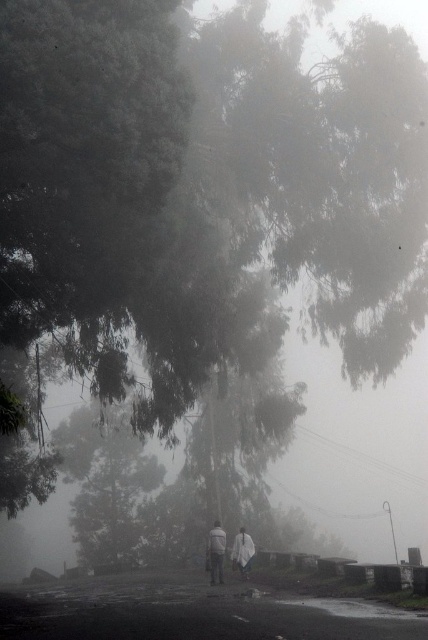
This screenshot has width=428, height=640. I want to click on white matte coat at center, so click(216, 552).

Which is behind, point (244, 550) or point (241, 556)?

The point (244, 550) is behind.

Image resolution: width=428 pixels, height=640 pixels. What do you see at coordinates (216, 552) in the screenshot?
I see `white matte coat at center` at bounding box center [216, 552].

The image size is (428, 640). I want to click on white matte coat at center, so click(x=216, y=552).

Does white matte jacket at lower center appear under white matte jacket at center?

Incorrect, white matte jacket at lower center is not positioned below white matte jacket at center.

Can you confirm if white matte jacket at lower center is shorter than white matte jacket at center?

Yes.

The image size is (428, 640). What do you see at coordinates (216, 552) in the screenshot? I see `white matte jacket at lower center` at bounding box center [216, 552].

The height and width of the screenshot is (640, 428). I want to click on white matte jacket at lower center, so click(216, 552).

Looking at this image, is white matte coat at center closer to the viewer compared to white matte jacket at lower center?

That is True.

Is point (213, 582) positioned before point (220, 529)?

No, (213, 582) is further to viewer.

Image resolution: width=428 pixels, height=640 pixels. What do you see at coordinates (216, 552) in the screenshot?
I see `white matte coat at center` at bounding box center [216, 552].

The height and width of the screenshot is (640, 428). Identify the location of white matte coat at center. (216, 552).